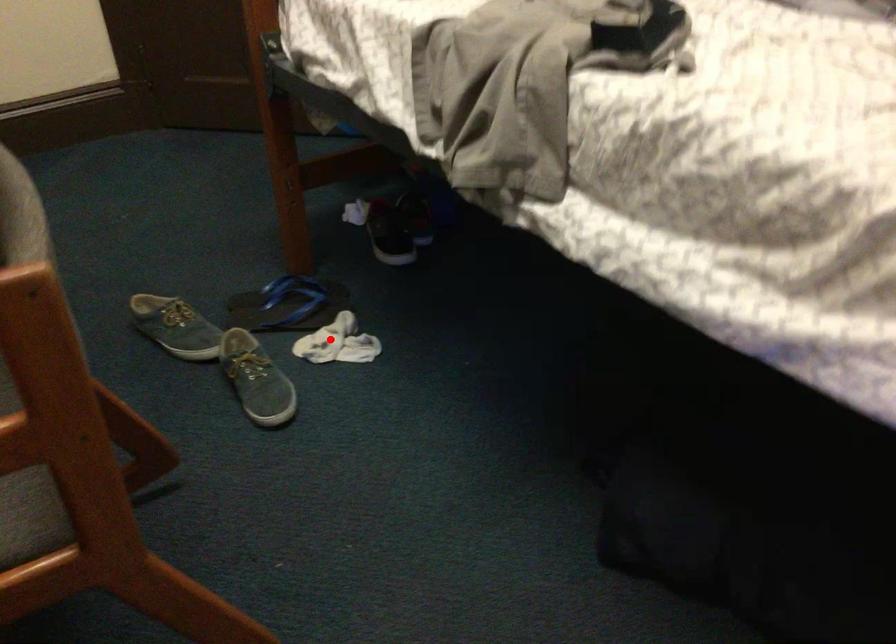
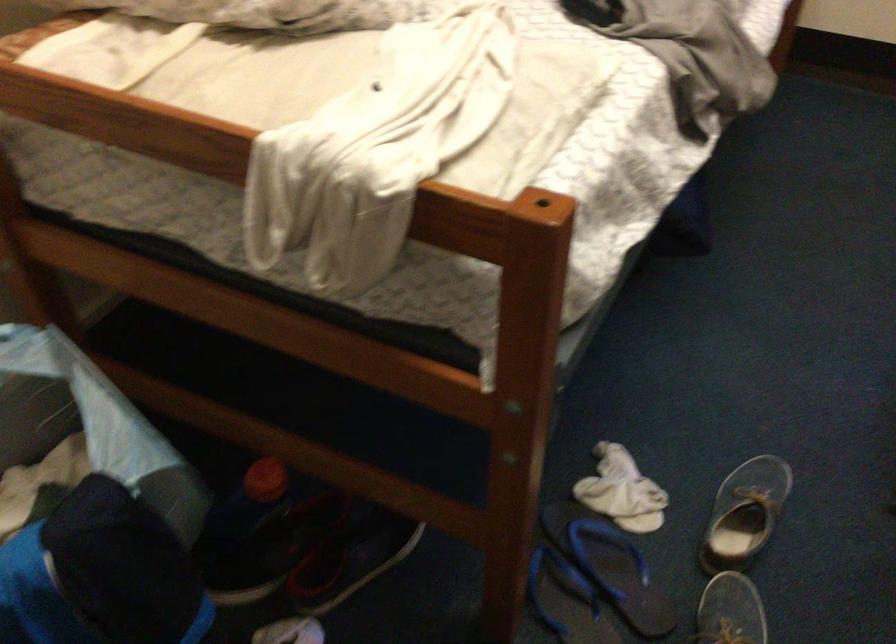
Question: A red point is marked in image1. In image2, is the corresponding 3D point closer to the camera or farther? Reply with the corresponding letter.

Choices:
 (A) The corresponding 3D point is closer.
 (B) The corresponding 3D point is farther.

Answer: (A)